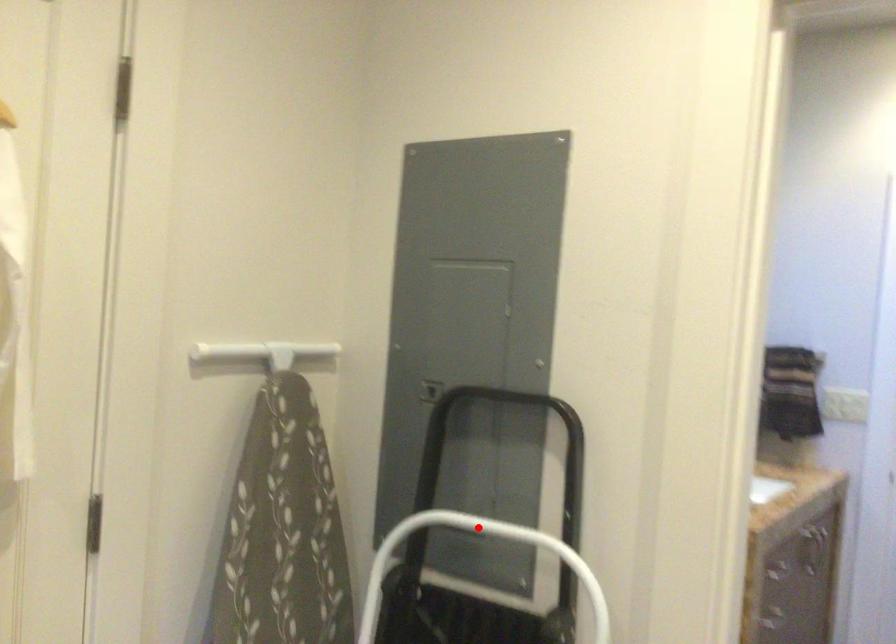
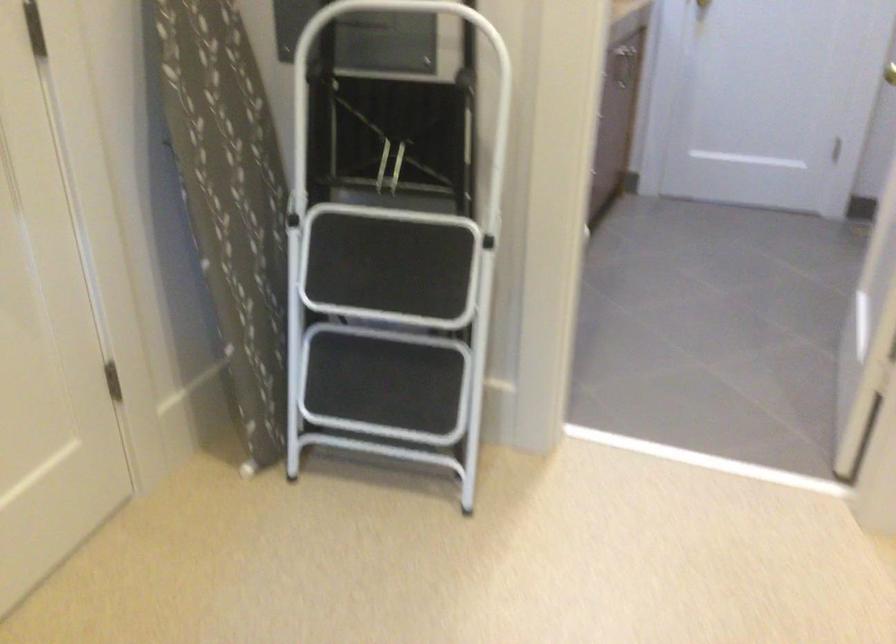
Question: I am providing you with two images of the same scene from different viewpoints. Image1 has a red point marked. In image2, the corresponding 3D location appears at what relative position? Reply with the corresponding letter.

Choices:
 (A) Closer
 (B) Farther

Answer: (B)